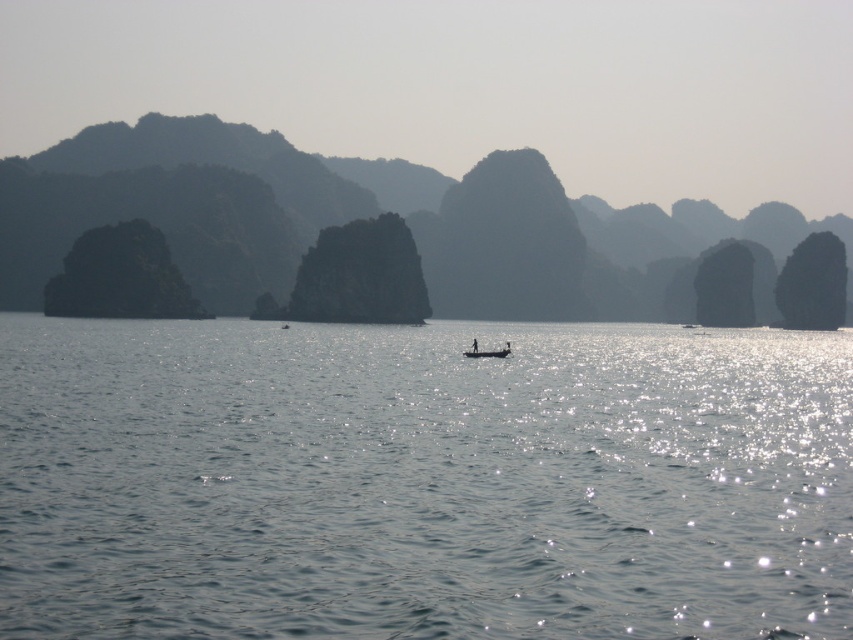
Who is higher up, clear water at center or wooden boat at center?

wooden boat at center

Is point (74, 445) in front of point (474, 353)?

Yes, point (74, 445) is closer to viewer.

Where is `clear water at center`? The width and height of the screenshot is (853, 640). clear water at center is located at coordinates (422, 481).